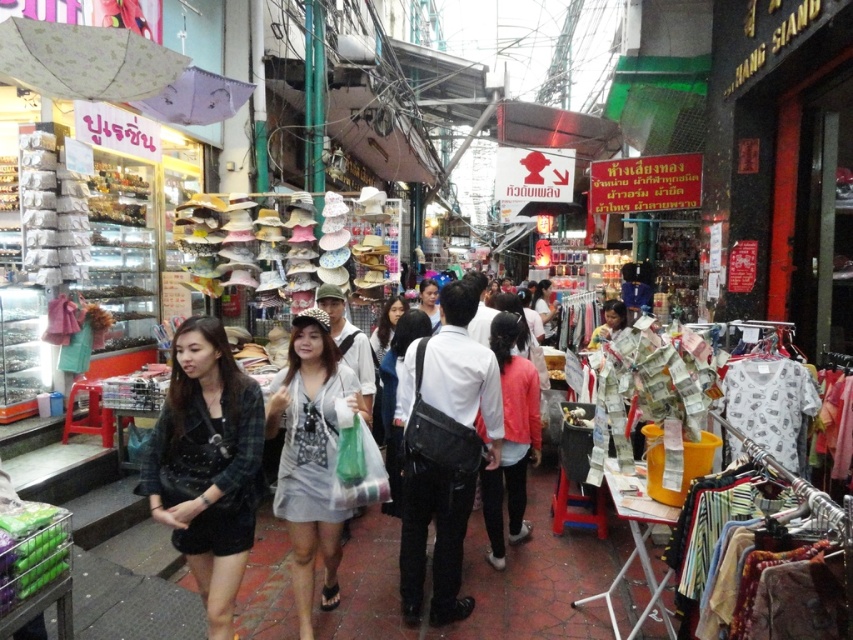
Can you confirm if black fuzzy jacket at lower left is positioned to the left of white cotton shirt at center?

Indeed, black fuzzy jacket at lower left is positioned on the left side of white cotton shirt at center.

What do you see at coordinates (207, 465) in the screenshot?
I see `black fuzzy jacket at lower left` at bounding box center [207, 465].

Locate an element on the screen. Image resolution: width=853 pixels, height=640 pixels. black fuzzy jacket at lower left is located at coordinates (207, 465).

Can you confirm if matte black shirt at center is positioned to the right of matte white shirt at center?

Incorrect, matte black shirt at center is not on the right side of matte white shirt at center.

Is matte black shirt at center taller than matte white shirt at center?

Correct, matte black shirt at center is much taller as matte white shirt at center.

Which is behind, point (390, 300) or point (426, 307)?

The point (426, 307) is more distant.

Locate an element on the screen. Image resolution: width=853 pixels, height=640 pixels. matte black shirt at center is located at coordinates (386, 326).

Who is more forward, [502,404] or [514,355]?

Point [502,404] is more forward.

Who is more distant from viewer, (x=421, y=380) or (x=517, y=364)?

Point (x=517, y=364)

Between point (460, 339) and point (489, 346), which one is positioned in front?

Positioned in front is point (460, 339).

Where is `white cotton shirt at center`? This screenshot has width=853, height=640. white cotton shirt at center is located at coordinates (454, 371).